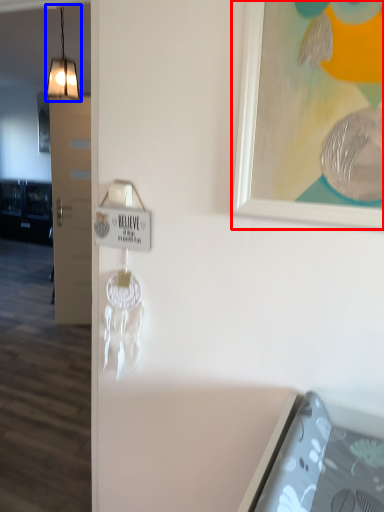
Question: Which object appears farthest to the camera in this image, picture frame (highlighted by a red box) or light (highlighted by a blue box)?

Choices:
 (A) picture frame
 (B) light

Answer: (B)